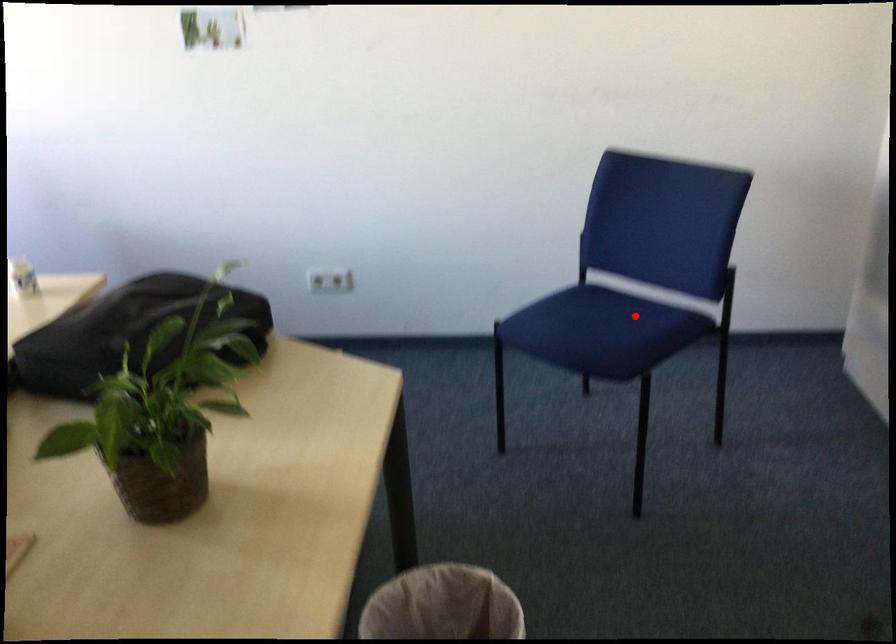
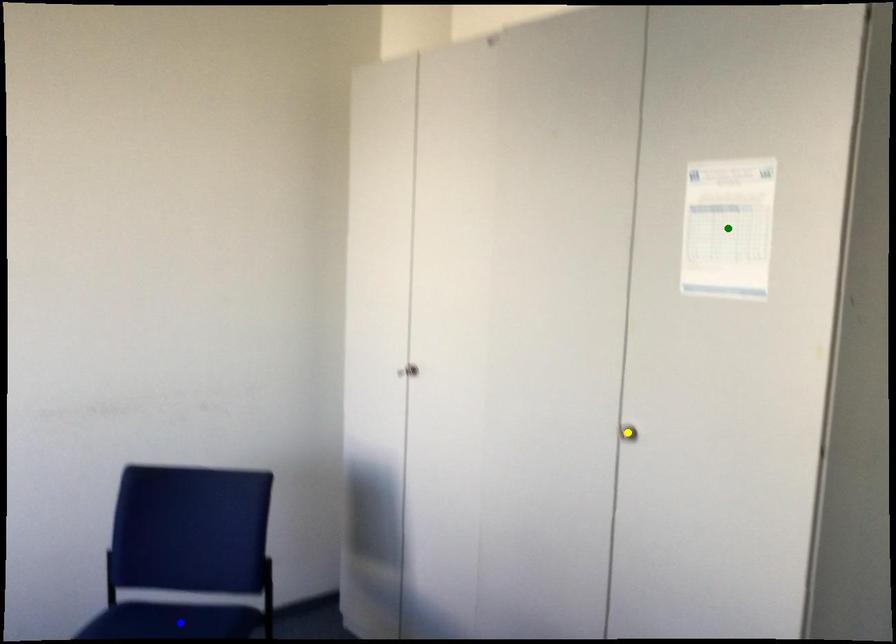
Question: I am providing you with two images of the same scene from different viewpoints. A red point is marked on the first image. You are given multiple points on the second image. In image 2, which mark is for the same physical point as the one in image 1?

Choices:
 (A) green point
 (B) yellow point
 (C) blue point

Answer: (C)